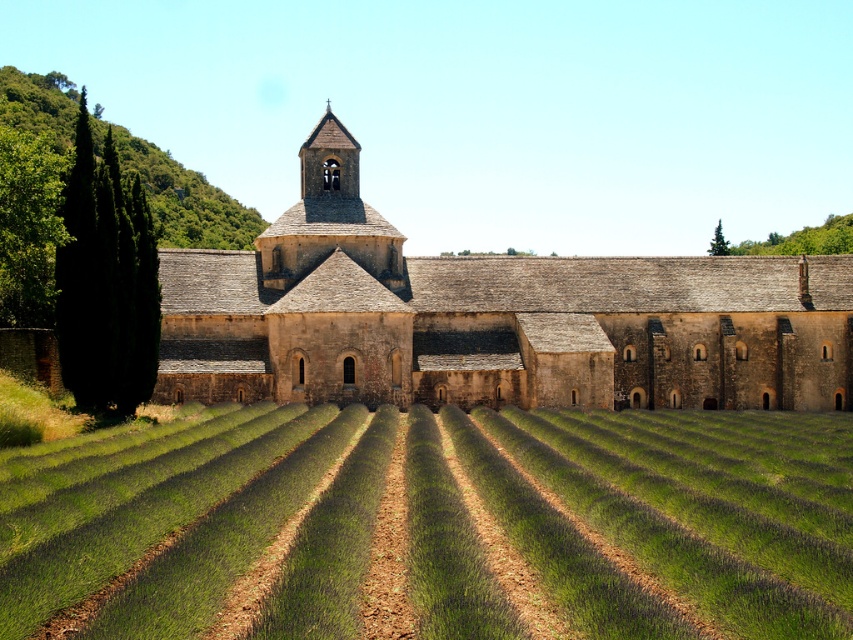
Who is positioned more to the right, green grass at center or green leafy hillside at upper left?

green grass at center

Is green grass at center in front of green leafy hillside at upper left?

Yes.

What are the coordinates of `green grass at center` in the screenshot? It's located at (674, 515).

Which is in front, point (642, 257) or point (19, 120)?

Point (642, 257) is more forward.

Based on the photo, can you confirm if brown stone church at center is shorter than green leafy hillside at upper left?

Correct, brown stone church at center is not as tall as green leafy hillside at upper left.

Between point (706, 369) and point (173, 170), which one is positioned behind?

Positioned behind is point (173, 170).

This screenshot has height=640, width=853. Identify the location of brown stone church at center. (490, 317).

Does green grass at center appear on the right side of brown stone church at center?

No, green grass at center is not to the right of brown stone church at center.

Which is more to the right, green grass at center or brown stone church at center?

Positioned to the right is brown stone church at center.

Does point (590, 506) come in front of point (819, 406)?

Yes, it is.

In order to click on green grass at center in this screenshot , I will do `click(674, 515)`.